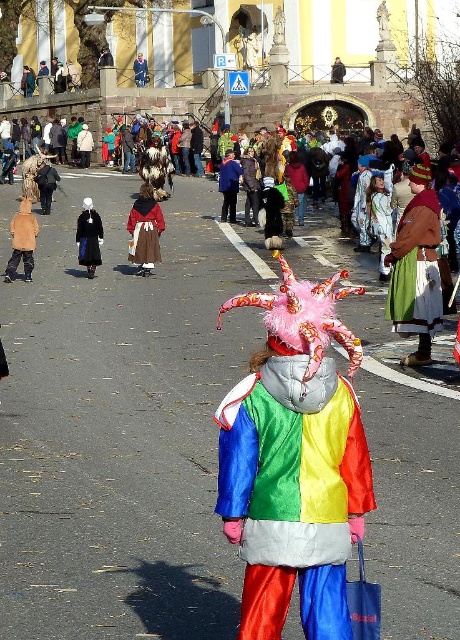
Between velvet brown coat at center and black wool coat at center, which one is positioned higher?

velvet brown coat at center is higher up.

Who is taller, velvet brown coat at center or black wool coat at center?

velvet brown coat at center

You are a GUI agent. You are given a task and a screenshot of the screen. Output one action in this format:
    pyautogui.click(x=<x>, y=<y>)
    Task: Click on the velvet brown coat at center
    The image size is (460, 640).
    Given the screenshot: What is the action you would take?
    pyautogui.click(x=144, y=230)

Who is lower down, rainbow satin costume at center or green satin skirt at center?

rainbow satin costume at center is lower down.

Is rainbow satin costume at center wider than green satin skirt at center?

Yes.

Find the location of a particular element. rainbow satin costume at center is located at coordinates (293, 492).

This screenshot has height=640, width=460. What are the coordinates of `rainbow satin costume at center` in the screenshot? It's located at pos(293,492).

Is point (408, 298) positioned behind point (79, 244)?

No, it is not.

Does green satin skirt at center have a lesser height compared to black wool coat at center?

In fact, green satin skirt at center may be taller than black wool coat at center.

Does point (410, 301) come behind point (79, 256)?

That is False.

Where is `green satin skirt at center`? The height and width of the screenshot is (640, 460). green satin skirt at center is located at coordinates (415, 266).